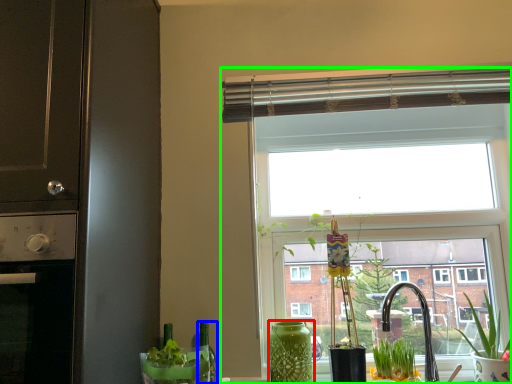
Question: Based on their relative distances, which object is nearer to vase (highlighted by a red box)? Choose from bottle (highlighted by a blue box) and window (highlighted by a green box).

Choices:
 (A) bottle
 (B) window

Answer: (A)